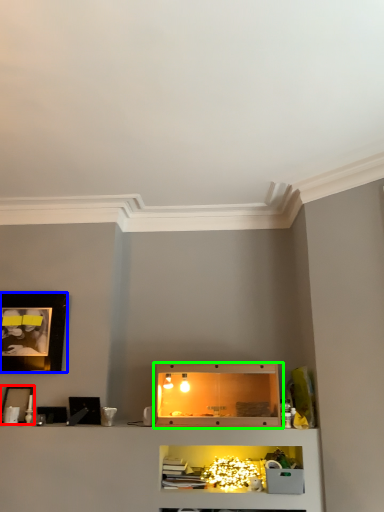
Question: Based on their relative distances, which object is farther from picture frame (highlighted by a red box)? Choose from picture frame (highlighted by a blue box) and shelf (highlighted by a green box).

Choices:
 (A) picture frame
 (B) shelf

Answer: (B)